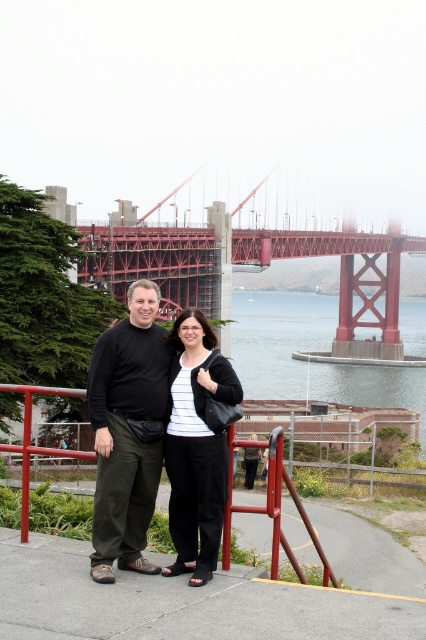
Question: Can you confirm if dark green pants at center is positioned to the left of black fabric jacket at center?

Choices:
 (A) no
 (B) yes

Answer: (B)

Question: Does clear water at center appear under black fabric jacket at center?

Choices:
 (A) yes
 (B) no

Answer: (B)

Question: Estimate the real-world distances between objects in this image. Which object is farther from the red metal suspension bridge at center?

Choices:
 (A) red metal railing at center
 (B) clear water at center
 (C) dark green pants at center

Answer: (C)

Question: Which point is farther to the camera?

Choices:
 (A) (195, 228)
 (B) (189, 314)
 (C) (109, 557)

Answer: (A)

Question: Is red metal suspension bridge at center to the right of red metal railing at center from the viewer's perspective?

Choices:
 (A) yes
 (B) no

Answer: (A)

Question: Which is nearer to the red metal railing at center?

Choices:
 (A) red metal suspension bridge at center
 (B) clear water at center

Answer: (A)